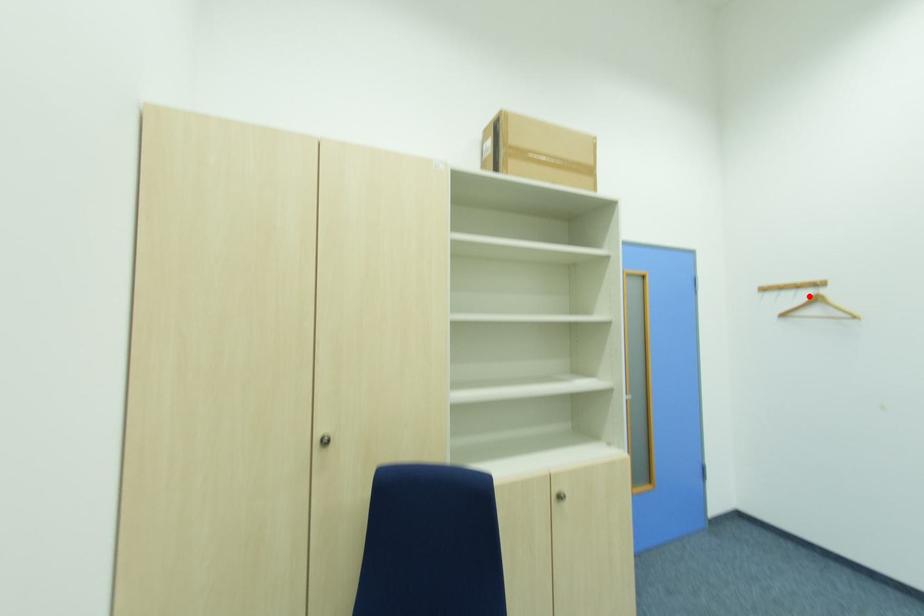
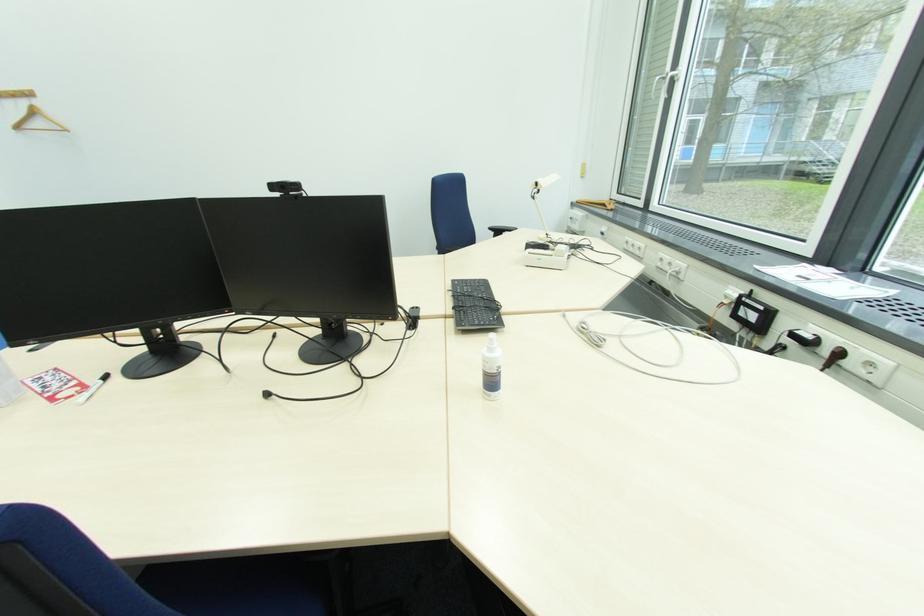
Question: A red point is marked in image1. In image2, is the corresponding 3D point closer to the camera or farther? Reply with the corresponding letter.

Choices:
 (A) The corresponding 3D point is closer.
 (B) The corresponding 3D point is farther.

Answer: (B)